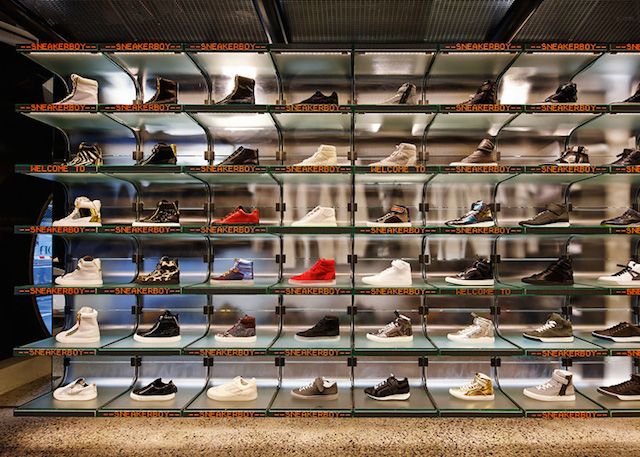
Image resolution: width=640 pixels, height=457 pixels. In order to click on sneakers on 2nd shelve in this screenshot , I will do `click(84, 333)`, `click(150, 333)`, `click(232, 331)`, `click(316, 328)`, `click(387, 329)`, `click(475, 332)`, `click(545, 333)`, `click(605, 333)`.